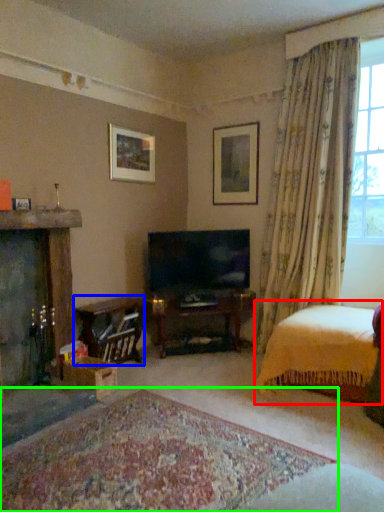
Question: Which object is the farthest from bed (highlighted by a red box)? Choose among these: table (highlighted by a blue box) or plain (highlighted by a green box).

Choices:
 (A) table
 (B) plain

Answer: (A)